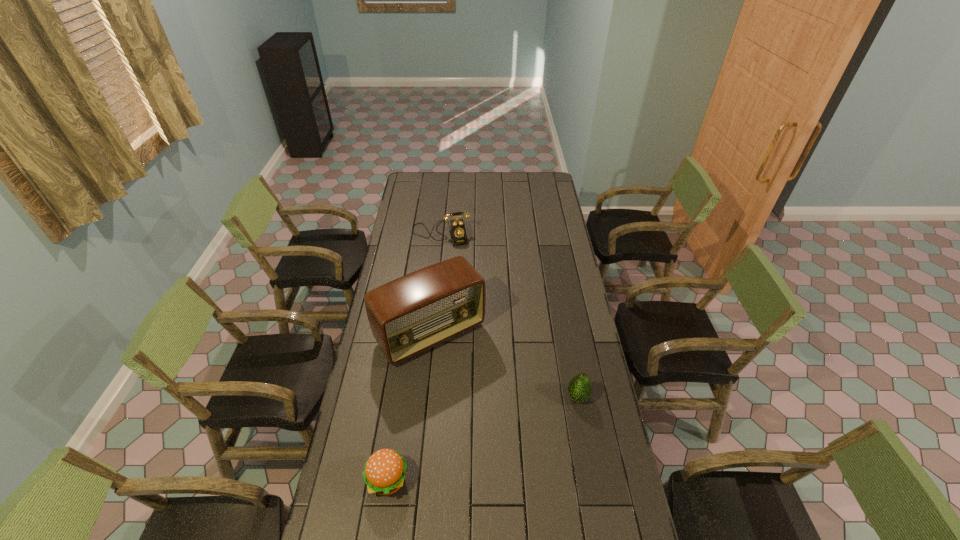
In the image, there is a desktop. Identify the location of free region at the right edge. The image size is (960, 540). pos(597,392).

This screenshot has height=540, width=960. I want to click on free space at the far left corner of the desktop, so click(424, 178).

In the image, there is a desktop. Where is `vacant space at the near right corner`? vacant space at the near right corner is located at coordinates point(619,534).

At what (x,y) coordinates should I click in order to perform the action: click on free space between the hamburger and the tallest object. Please return your answer as a coordinate pair (x, y). This screenshot has width=960, height=540. Looking at the image, I should click on (409, 407).

I want to click on vacant space that's between the tallest object and the hamburger, so click(x=409, y=407).

At what (x,y) coordinates should I click in order to perform the action: click on free space that is in between the nearest object and the avocado. Please return your answer as a coordinate pair (x, y). This screenshot has width=960, height=540. Looking at the image, I should click on (483, 439).

Find the location of `vacant area between the tallest object and the rightmost object`. vacant area between the tallest object and the rightmost object is located at coordinates (504, 366).

Where is `free area in between the tallest object and the avocado`? This screenshot has width=960, height=540. free area in between the tallest object and the avocado is located at coordinates (504, 366).

The width and height of the screenshot is (960, 540). In order to click on empty space that is in between the farthest object and the third farthest object in this screenshot , I will do `click(510, 315)`.

Locate an element on the screen. The image size is (960, 540). object that is the closest to the hamburger is located at coordinates (409, 315).